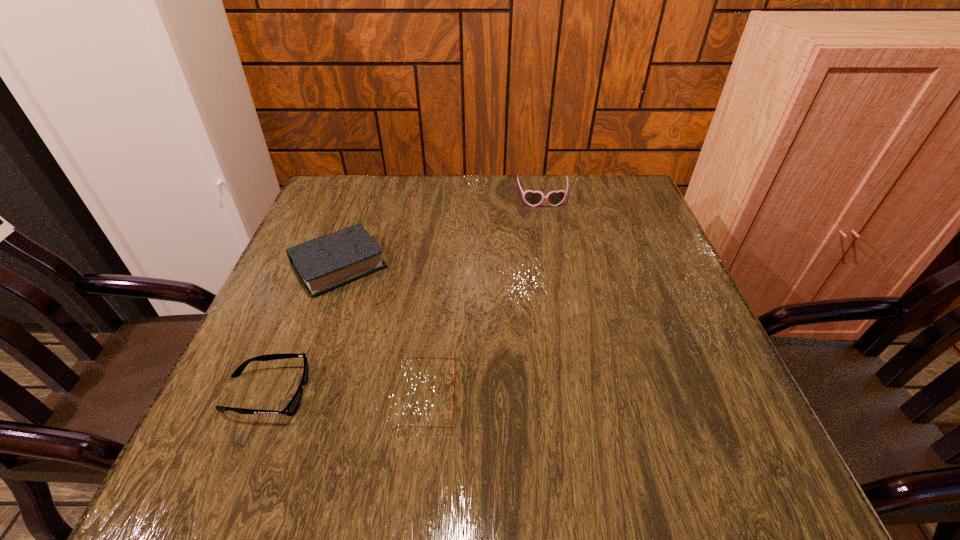
Identify the location of blank region between the Bible and the second sunglasses from left to right. (383, 332).

At what (x,y) coordinates should I click in order to perform the action: click on empty space that is in between the second object from right to left and the leftmost sunglasses. Please return your answer as a coordinate pair (x, y). The height and width of the screenshot is (540, 960). Looking at the image, I should click on (347, 395).

Image resolution: width=960 pixels, height=540 pixels. I want to click on vacant area between the farthest sunglasses and the second farthest object, so click(441, 232).

The height and width of the screenshot is (540, 960). I want to click on vacant point located between the second sunglasses from left to right and the second farthest object, so click(383, 332).

You are a GUI agent. You are given a task and a screenshot of the screen. Output one action in this format:
    pyautogui.click(x=<x>, y=<y>)
    Task: Click on the free space that is in between the Bible and the leftmost sunglasses
    The height and width of the screenshot is (540, 960).
    Given the screenshot: What is the action you would take?
    pyautogui.click(x=302, y=329)

I want to click on vacant area that lies between the third object from left to right and the farthest object, so click(x=484, y=298).

The image size is (960, 540). I want to click on empty space that is in between the leftmost sunglasses and the second farthest object, so click(302, 329).

At what (x,y) coordinates should I click in order to perform the action: click on empty location between the farthest sunglasses and the leftmost sunglasses. Please return your answer as a coordinate pair (x, y). The height and width of the screenshot is (540, 960). Looking at the image, I should click on (404, 296).

Find the location of a particular element. This screenshot has height=540, width=960. unoccupied position between the second farthest object and the tallest sunglasses is located at coordinates (441, 232).

Find the location of a particular element. This screenshot has height=540, width=960. free spot between the second farthest object and the leftmost sunglasses is located at coordinates (302, 329).